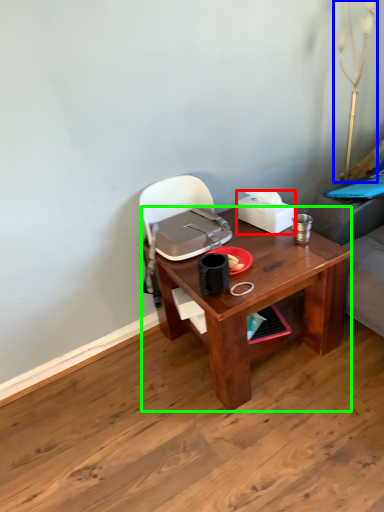
Question: Which object is the farthest from box (highlighted by a red box)? Choose among these: table lamp (highlighted by a blue box) or desk (highlighted by a green box).

Choices:
 (A) table lamp
 (B) desk

Answer: (A)